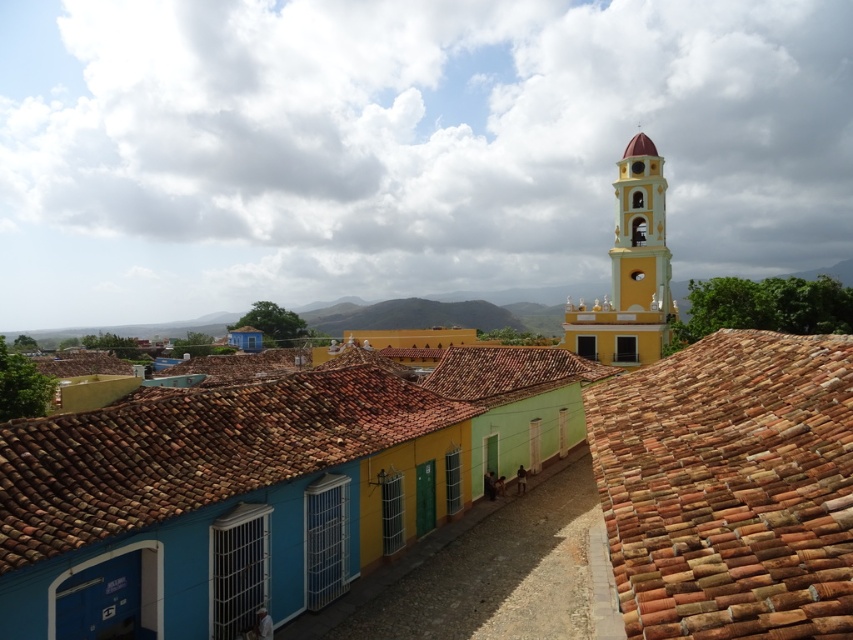
You are a tourist standing on the cobblestone street in front of the buildings. You notice the terracotta tiles at right and the yellow matte tower at upper right. Which structure appears taller from your vantage point?

The yellow matte tower at upper right appears taller than the terracotta tiles at right because it is taller than the tiles.

You are standing on the cobblestone street in front of the colonial buildings. You notice two points marked in the scene. The first point is located at coordinates point [758,481] and the second point is at point [602,346]. Which of these two points is nearer to your current position?

Point [758,481] is closer to the camera than point [602,346], so the first point is nearer to your current position.